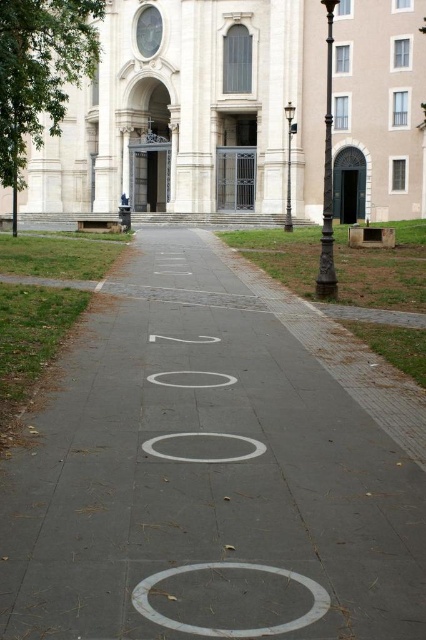
Question: Estimate the real-world distances between objects in this image. Which object is closer to the white concrete pavement at center?

Choices:
 (A) white smooth circle at center
 (B) white matte circle at center

Answer: (A)

Question: Is white concrete pavement at center to the left of white matte circle at center from the viewer's perspective?

Choices:
 (A) no
 (B) yes

Answer: (A)

Question: Can you confirm if white concrete circle at center is wider than white smooth circle at center?

Choices:
 (A) yes
 (B) no

Answer: (A)

Question: Based on their relative distances, which object is nearer to the white concrete circle at center?

Choices:
 (A) white matte circle at center
 (B) white concrete pavement at center

Answer: (A)

Question: Where is white concrete circle at center located in relation to white smooth circle at center in the image?

Choices:
 (A) above
 (B) below

Answer: (B)

Question: Which is nearer to the white concrete pavement at center?

Choices:
 (A) white smooth circle at center
 (B) white concrete circle at center

Answer: (A)